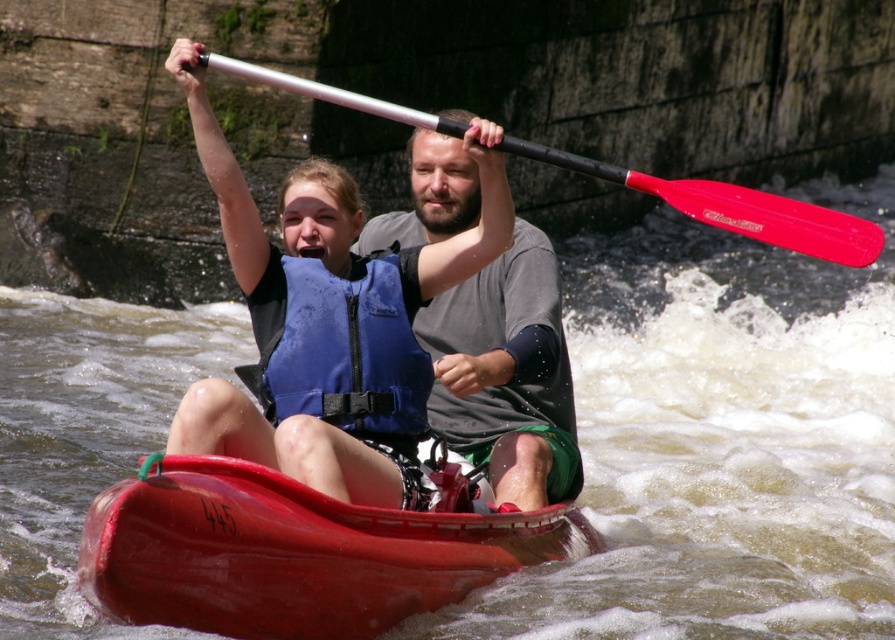
You are a safety inspector checking the kayak setup. The safety guidelines require that the distance between the blue life vest at center and the metallic paddle at upper center must not exceed 3 meters for quick access. Is this setup compliant?

The blue life vest at center is 5.85 meters away from the metallic paddle at upper center, which exceeds the 3 meter requirement. This setup is not compliant with safety guidelines.

Based on the photo, you are navigating a kayak and need to reach a point marked by coordinates. You see two points in the image, point (293, 189) and point (508, 486). Which point is closer to the front of the kayak?

Point (508, 486) is closer to the front of the kayak because it is in front of point (293, 189).